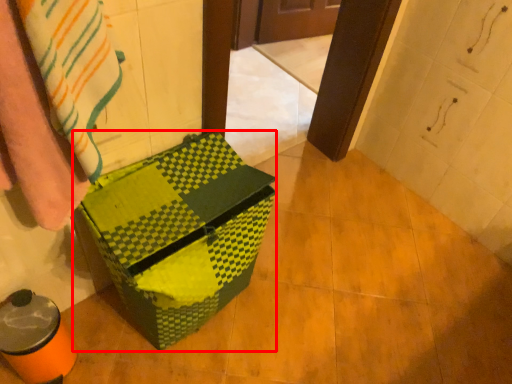
Question: In this image, where is cardboard box (annotated by the red box) located relative to blanket?

Choices:
 (A) left
 (B) right

Answer: (B)